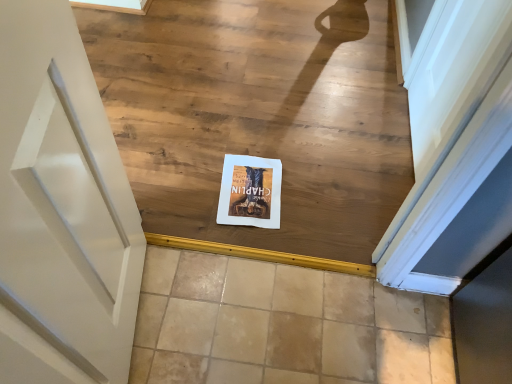
Question: Does beige tile at center have a larger size compared to white paper at center?

Choices:
 (A) no
 (B) yes

Answer: (A)

Question: Considering the relative sizes of beige tile at center and white paper at center in the image provided, is beige tile at center thinner than white paper at center?

Choices:
 (A) no
 (B) yes

Answer: (B)

Question: Does beige tile at center appear on the right side of white paper at center?

Choices:
 (A) yes
 (B) no

Answer: (A)

Question: Is beige tile at center smaller than white paper at center?

Choices:
 (A) no
 (B) yes

Answer: (B)

Question: Can you confirm if beige tile at center is wider than white paper at center?

Choices:
 (A) no
 (B) yes

Answer: (A)

Question: From a real-world perspective, is white paper at center above or below matte paper postcard at center?

Choices:
 (A) above
 (B) below

Answer: (A)

Question: Considering the positions of white paper at center and matte paper postcard at center in the image, is white paper at center wider or thinner than matte paper postcard at center?

Choices:
 (A) wide
 (B) thin

Answer: (A)

Question: From the image's perspective, is white paper at center located above or below matte paper postcard at center?

Choices:
 (A) above
 (B) below

Answer: (A)

Question: Is point (367, 180) positioned closer to the camera than point (272, 211)?

Choices:
 (A) farther
 (B) closer

Answer: (A)

Question: Is beige tile at center situated inside white paper at center or outside?

Choices:
 (A) inside
 (B) outside

Answer: (B)

Question: Considering the positions of beige tile at center and white paper at center in the image, is beige tile at center taller or shorter than white paper at center?

Choices:
 (A) tall
 (B) short

Answer: (B)

Question: Is point (372, 339) closer or farther from the camera than point (112, 76)?

Choices:
 (A) farther
 (B) closer

Answer: (B)

Question: From the image's perspective, relative to white paper at center, is beige tile at center above or below?

Choices:
 (A) below
 (B) above

Answer: (A)

Question: In the image, is matte paper postcard at center on the left side or the right side of beige tile at center?

Choices:
 (A) left
 (B) right

Answer: (A)

Question: Is matte paper postcard at center wider or thinner than beige tile at center?

Choices:
 (A) thin
 (B) wide

Answer: (A)